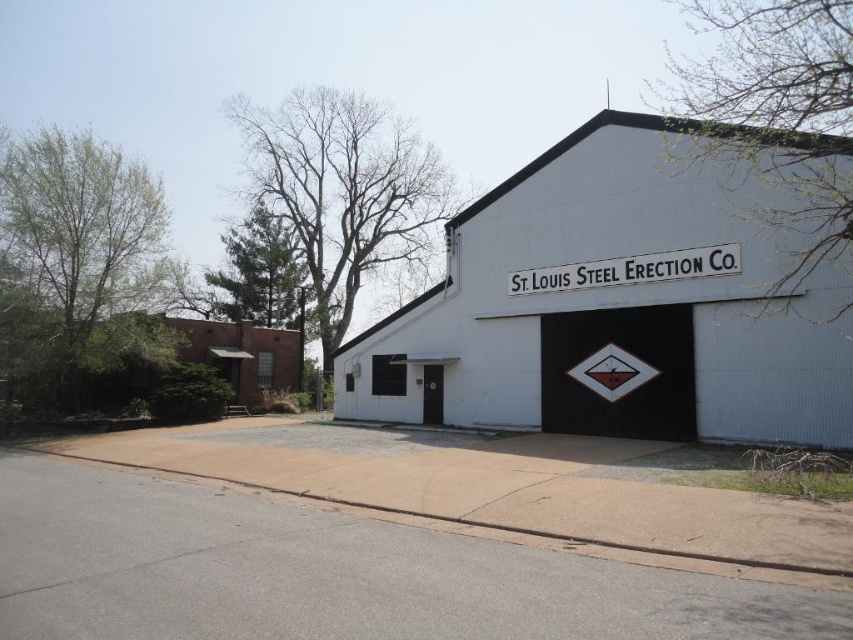
Is point (683, 268) closer to viewer compared to point (616, 349)?

Yes, it is in front of point (616, 349).

What do you see at coordinates (628, 269) in the screenshot? I see `white painted signboard at center` at bounding box center [628, 269].

The image size is (853, 640). I want to click on white painted signboard at center, so click(628, 269).